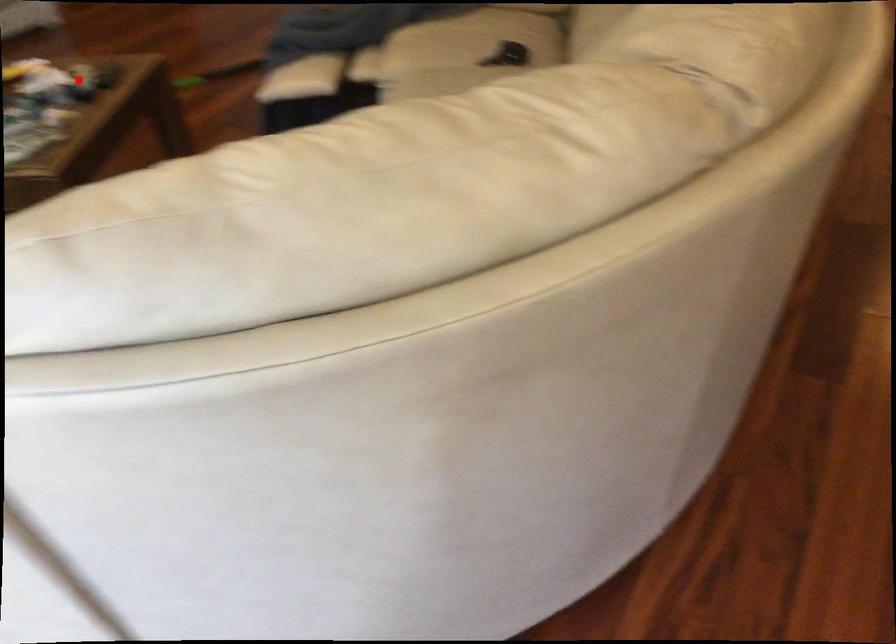
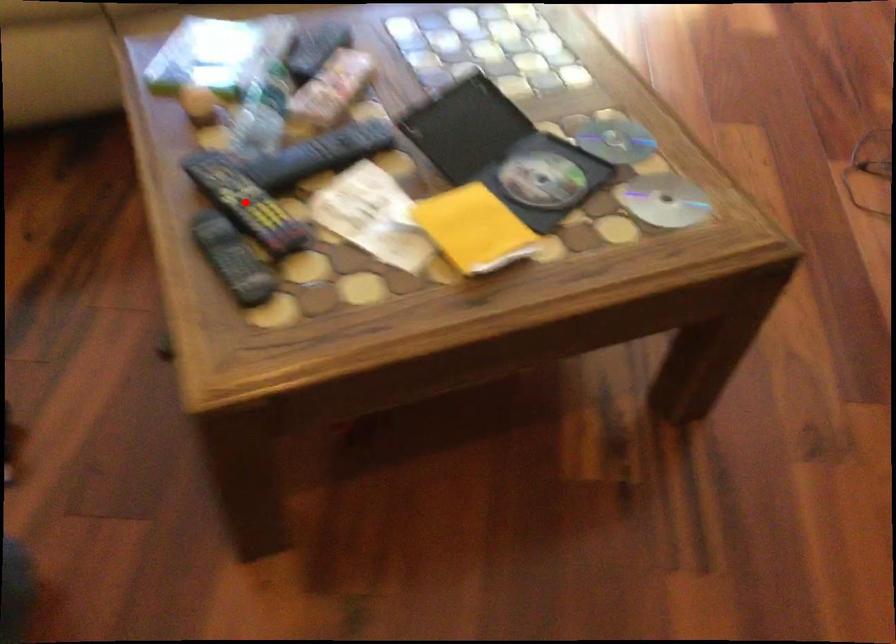
I am providing you with two images of the same scene from different viewpoints. A red point is marked on the first image and another point is marked on the second image. Are the points marked in image1 and image2 representing the same 3D position?

Yes